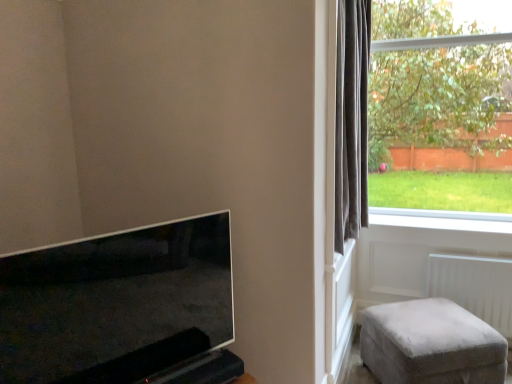
Identify the location of free space above white plastic radiator at lower right (from a real-world perspective). pos(470,259).